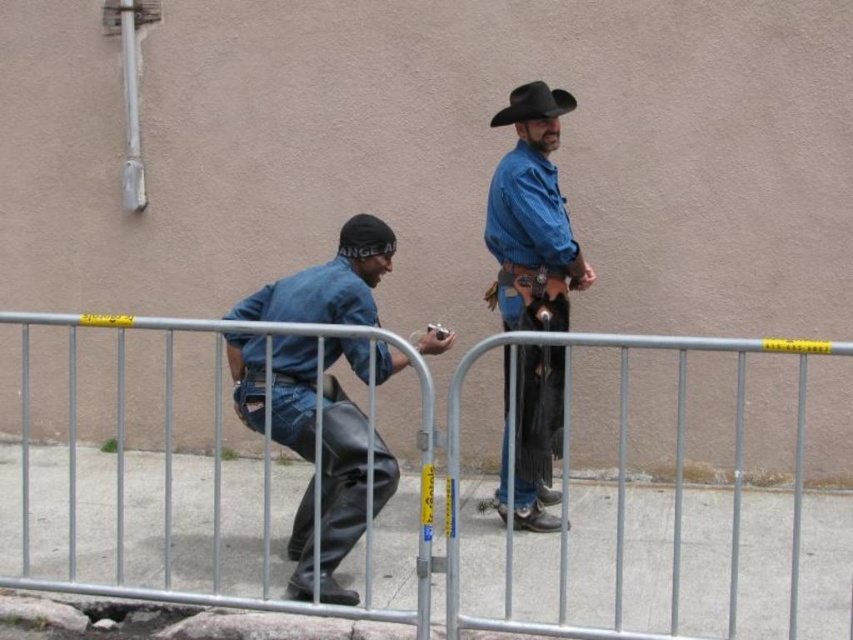
Question: Among these points, which one is farthest from the camera?

Choices:
 (A) (682, 624)
 (B) (259, 294)

Answer: (B)

Question: Among these points, which one is farthest from the camera?

Choices:
 (A) (752, 522)
 (B) (509, 116)
 (C) (367, 225)
 (D) (506, 212)

Answer: (A)

Question: Which point appears farthest from the camera in this image?

Choices:
 (A) (486, 570)
 (B) (308, 337)
 (C) (555, 102)

Answer: (C)

Question: Can you confirm if matte blue shirt at center is positioned to the left of black felt cowboy hat at upper center?

Choices:
 (A) yes
 (B) no

Answer: (A)

Question: Can you confirm if metal at center is positioned below blue denim shirt at upper right?

Choices:
 (A) yes
 (B) no

Answer: (A)

Question: Can you confirm if blue denim shirt at upper right is thinner than black felt cowboy hat at upper center?

Choices:
 (A) no
 (B) yes

Answer: (A)